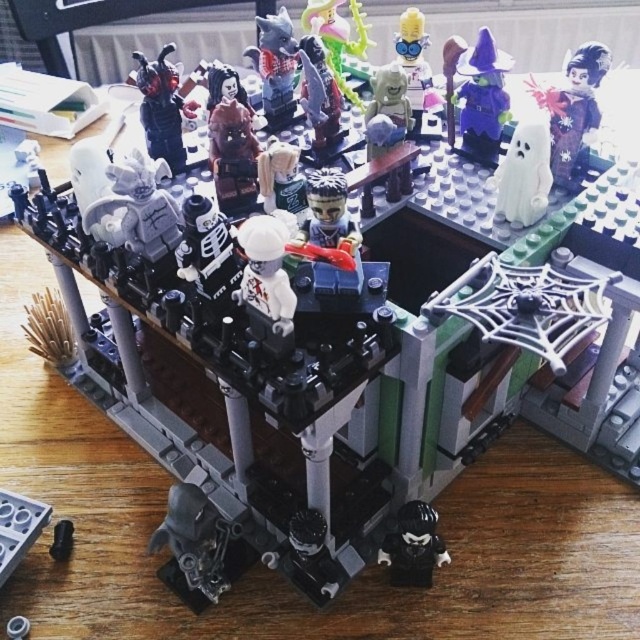
You are a tiny LEGO figure standing at the bottom of the haunted house. You notice a purple matte wizard hat at upper right. If you look straight ahead, will you see the point at coordinates (477, 93) on the purple matte wizard hat at upper right?

Yes, the point at coordinates (477, 93) is located on the purple matte wizard hat at upper right, so if you look straight ahead towards that hat, you will see the point.

Looking at the LEGO haunted house scene, you notice the purple matte wizard hat at upper right and the black plastic figure at lower center. Which object is positioned higher in the image?

The purple matte wizard hat at upper right is positioned higher than the black plastic figure at lower center.

You are a child trying to place the white matte minifigure at center and the matte gray wolf at upper center on a small shelf. The shelf can only hold items that are no taller than 10 cm. According to the scene description, will both fit?

The white matte minifigure at center is larger in size than the matte gray wolf at upper center. Since the shelf has a 10 cm height limit, it depends on the exact sizes. However, without specific height measurements provided, we cannot definitively determine if both will fit.